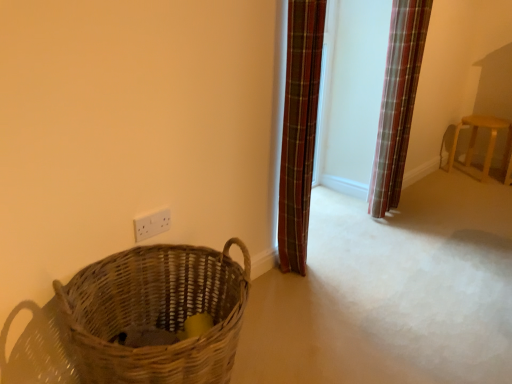
Question: Is the position of plaid fabric curtain at right, which ranks as the second curtain in front-to-back order, more distant than that of white plastic electric outlet at lower left?

Choices:
 (A) yes
 (B) no

Answer: (A)

Question: Could white plastic electric outlet at lower left be considered to be inside plaid fabric curtain at right, the first curtain when ordered from right to left?

Choices:
 (A) no
 (B) yes

Answer: (A)

Question: Considering the relative sizes of plaid fabric curtain at right, which appears as the first curtain when viewed from the back, and white plastic electric outlet at lower left in the image provided, is plaid fabric curtain at right, which appears as the first curtain when viewed from the back, thinner than white plastic electric outlet at lower left?

Choices:
 (A) no
 (B) yes

Answer: (A)

Question: Is plaid fabric curtain at right, which ranks as the second curtain in front-to-back order, at the left side of white plastic electric outlet at lower left?

Choices:
 (A) yes
 (B) no

Answer: (B)

Question: Is plaid fabric curtain at right, which ranks as the second curtain in front-to-back order, closer to camera compared to white plastic electric outlet at lower left?

Choices:
 (A) yes
 (B) no

Answer: (B)

Question: In terms of width, does woven brown basket at lower left look wider or thinner when compared to plaid fabric curtain at right, which ranks as the second curtain in front-to-back order?

Choices:
 (A) wide
 (B) thin

Answer: (A)

Question: Is woven brown basket at lower left spatially inside plaid fabric curtain at right, positioned as the second curtain in left-to-right order, or outside of it?

Choices:
 (A) inside
 (B) outside

Answer: (B)

Question: Considering their positions, is woven brown basket at lower left located in front of or behind plaid fabric curtain at right, the first curtain when ordered from right to left?

Choices:
 (A) front
 (B) behind

Answer: (A)

Question: Is point (157, 362) closer or farther from the camera than point (390, 134)?

Choices:
 (A) closer
 (B) farther

Answer: (A)

Question: Would you say white plastic electric outlet at lower left is inside or outside plaid fabric curtain at center, placed as the first curtain when sorted from left to right?

Choices:
 (A) inside
 (B) outside

Answer: (B)

Question: From a real-world perspective, relative to plaid fabric curtain at center, which is the second curtain in back-to-front order, is white plastic electric outlet at lower left vertically above or below?

Choices:
 (A) below
 (B) above

Answer: (A)

Question: In terms of height, does white plastic electric outlet at lower left look taller or shorter compared to plaid fabric curtain at center, placed as the first curtain when sorted from left to right?

Choices:
 (A) tall
 (B) short

Answer: (B)

Question: From the image's perspective, is white plastic electric outlet at lower left above or below plaid fabric curtain at center, which is the second curtain in back-to-front order?

Choices:
 (A) below
 (B) above

Answer: (A)

Question: Is white plastic electric outlet at lower left spatially inside plaid fabric curtain at right, the first curtain when ordered from right to left, or outside of it?

Choices:
 (A) inside
 (B) outside

Answer: (B)

Question: Considering the positions of white plastic electric outlet at lower left and plaid fabric curtain at right, which ranks as the second curtain in front-to-back order, in the image, is white plastic electric outlet at lower left wider or thinner than plaid fabric curtain at right, which ranks as the second curtain in front-to-back order,?

Choices:
 (A) thin
 (B) wide

Answer: (A)